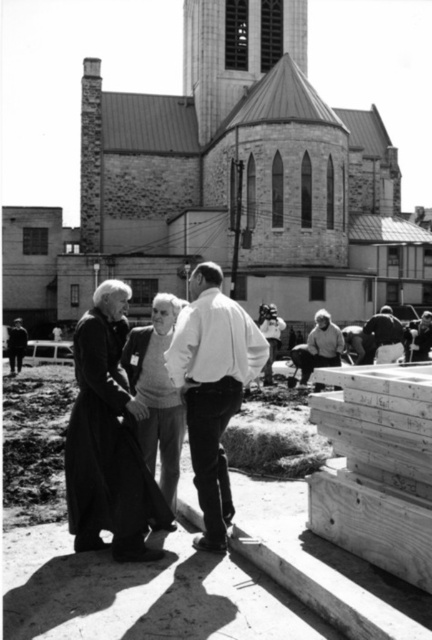
Who is more distant from viewer, (193, 28) or (386, 340)?

The point (193, 28) is more distant.

Consider the image. Is stone church at center wider than dark gray fabric jacket at lower right?

Yes, stone church at center is wider than dark gray fabric jacket at lower right.

Is point (410, 268) positioned before point (378, 333)?

No, (410, 268) is further to viewer.

You are a GUI agent. You are given a task and a screenshot of the screen. Output one action in this format:
    pyautogui.click(x=<x>, y=<y>)
    Task: Click on the stone church at center
    Image resolution: width=432 pixels, height=640 pixels.
    Given the screenshot: What is the action you would take?
    pyautogui.click(x=225, y=186)

Is point (146, 294) farther from camera compared to point (190, 442)?

Yes.

Can you confirm if stone church at center is positioned below white matte shirt at center?

Actually, stone church at center is above white matte shirt at center.

Is point (368, 125) more distant than point (213, 435)?

Yes, point (368, 125) is behind point (213, 435).

Identify the location of stone church at center. The image size is (432, 640). click(225, 186).

Can you confirm if white matte shirt at center is positioned above dark gray fabric jacket at lower right?

Indeed, white matte shirt at center is positioned over dark gray fabric jacket at lower right.

Which is more to the right, white matte shirt at center or dark gray fabric jacket at lower right?

dark gray fabric jacket at lower right is more to the right.

This screenshot has width=432, height=640. Identify the location of white matte shirt at center. (212, 388).

Locate an element on the screen. Image resolution: width=432 pixels, height=640 pixels. white matte shirt at center is located at coordinates (212, 388).